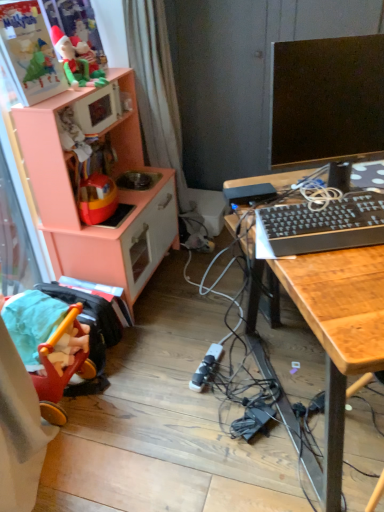
The height and width of the screenshot is (512, 384). Find the location of `free area in between white fabric curtain at center and black plastic plug at center`. free area in between white fabric curtain at center and black plastic plug at center is located at coordinates (185, 300).